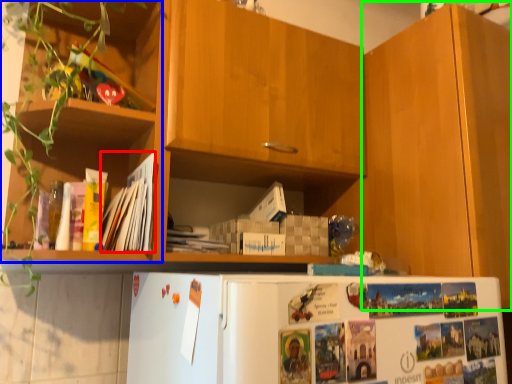
Question: Based on their relative distances, which object is nearer to magazine (highlighted by a red box)? Choose from shelf (highlighted by a blue box) and cabinetry (highlighted by a green box).

Choices:
 (A) shelf
 (B) cabinetry

Answer: (A)